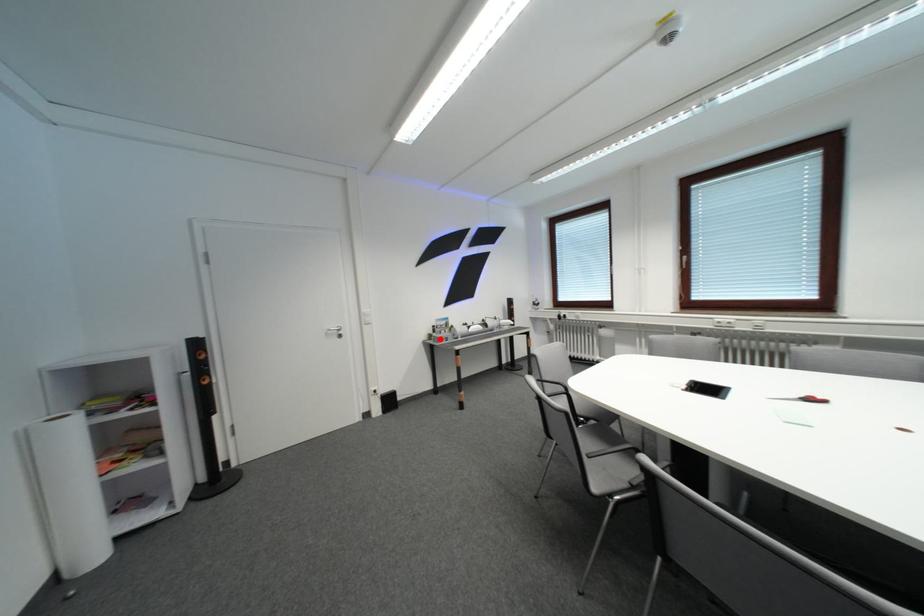
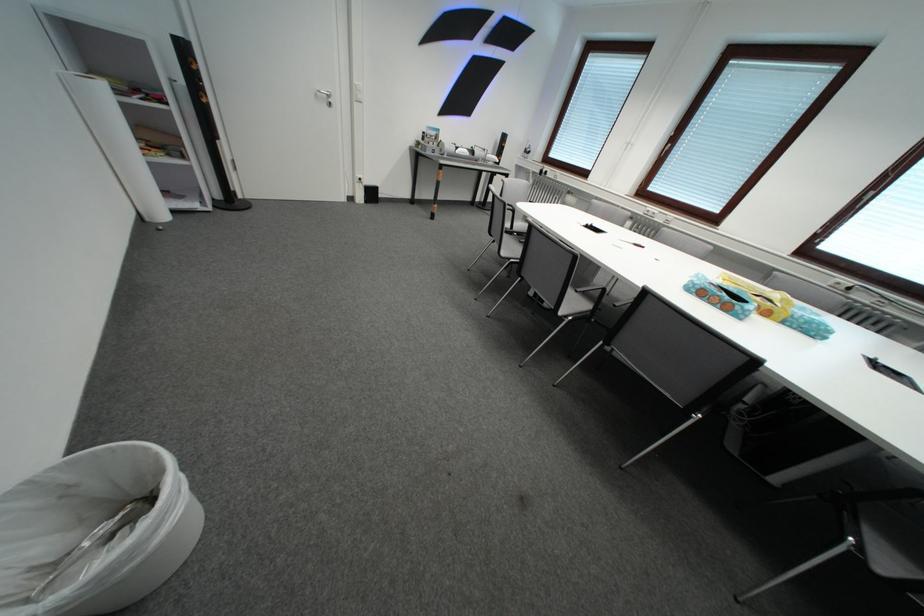
In the second image, find the point that corresponds to the highlighted location in the first image.

(429, 146)